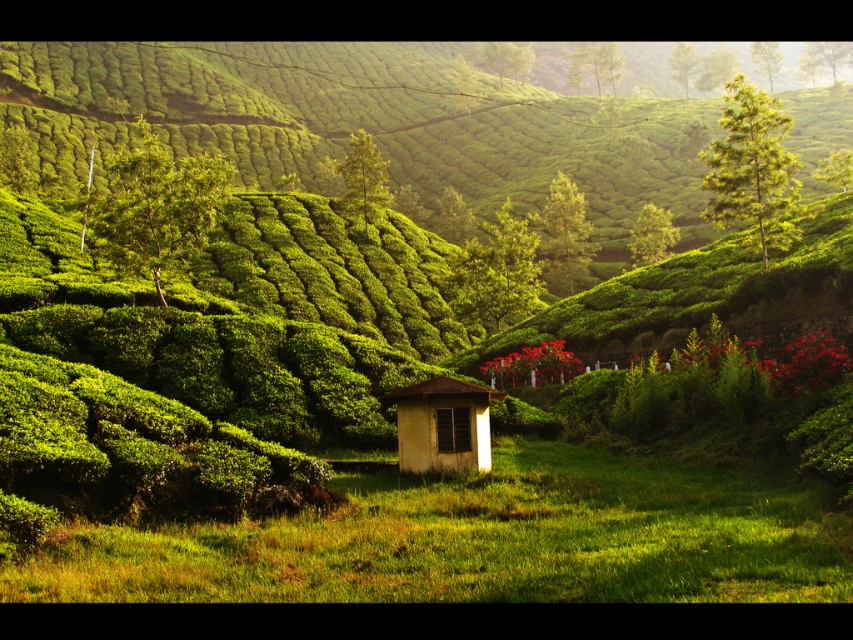
Question: Which point is farther to the camera?

Choices:
 (A) green leafy tree at upper right
 (B) white matte gazebo at center
 (C) green leafy hillside at center

Answer: (C)

Question: Which of these objects is positioned farthest from the green leafy tree at upper right?

Choices:
 (A) green grassy field at center
 (B) white matte gazebo at center

Answer: (A)

Question: From the image, what is the correct spatial relationship of green leafy hillside at center in relation to white matte gazebo at center?

Choices:
 (A) above
 (B) below

Answer: (A)

Question: Is green leafy tree at upper right thinner than white matte gazebo at center?

Choices:
 (A) no
 (B) yes

Answer: (A)

Question: Does green leafy hillside at center have a smaller size compared to green leafy tree at upper right?

Choices:
 (A) yes
 (B) no

Answer: (B)

Question: Among these points, which one is nearest to the camera?

Choices:
 (A) (485, 529)
 (B) (514, 163)

Answer: (A)